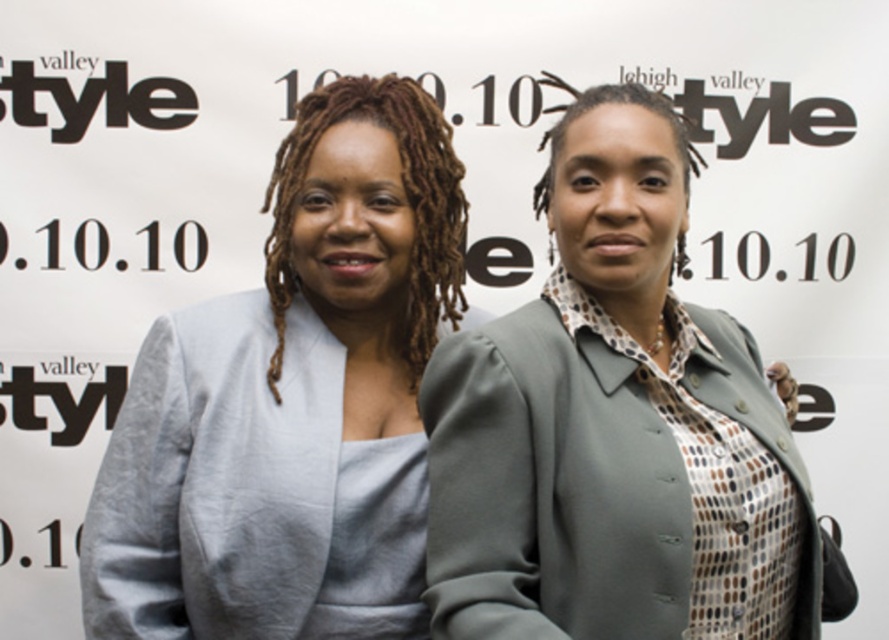
Question: Does matte gray blazer at center have a greater width compared to matte gray blazer at left?

Choices:
 (A) yes
 (B) no

Answer: (A)

Question: Which point appears farthest from the camera in this image?

Choices:
 (A) (340, 129)
 (B) (723, 524)

Answer: (A)

Question: Does matte gray blazer at center appear on the right side of matte gray blazer at left?

Choices:
 (A) yes
 (B) no

Answer: (A)

Question: Can you confirm if matte gray blazer at center is positioned below matte gray blazer at left?

Choices:
 (A) yes
 (B) no

Answer: (B)